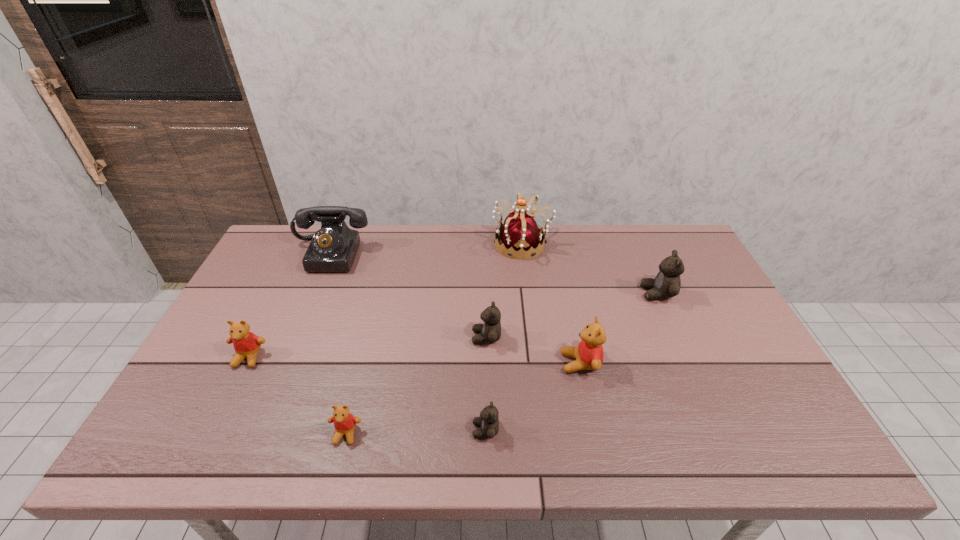
Locate an element on the screen. The height and width of the screenshot is (540, 960). free area in between the second smallest brown teddy bear and the nearest brown teddy bear is located at coordinates (486, 384).

Locate an element on the screen. The height and width of the screenshot is (540, 960). free space between the third farthest object and the second nearest brown teddy bear is located at coordinates (572, 315).

At what (x,y) coordinates should I click in order to perform the action: click on object that is the nearest to the smallest brown teddy bear. Please return your answer as a coordinate pair (x, y). Looking at the image, I should click on (490, 331).

Identify which object is the fourth closest to the second farthest brown teddy bear. Please provide its 2D coordinates. Your answer should be formatted as a tuple, i.e. [(x, y)], where the tuple contains the x and y coordinates of a point satisfying the conditions above.

[(344, 423)]

Where is `the closest teddy bear to the rightmost red teddy bear`? This screenshot has width=960, height=540. the closest teddy bear to the rightmost red teddy bear is located at coordinates (490, 331).

At what (x,y) coordinates should I click in order to perform the action: click on teddy bear that is the fourth nearest to the nearest red teddy bear. Please return your answer as a coordinate pair (x, y). The width and height of the screenshot is (960, 540). Looking at the image, I should click on (588, 355).

This screenshot has width=960, height=540. What are the coordinates of `brown teddy bear that is the closest to the second teddy bear from left to right` in the screenshot? It's located at (488, 421).

Find the location of a particular element. brown teddy bear that is the nearest to the second farthest brown teddy bear is located at coordinates (488, 421).

Identify which red teddy bear is the second closest to the smallest brown teddy bear. Please provide its 2D coordinates. Your answer should be formatted as a tuple, i.e. [(x, y)], where the tuple contains the x and y coordinates of a point satisfying the conditions above.

[(344, 423)]

Identify the location of the third closest red teddy bear relative to the rightmost brown teddy bear. (246, 344).